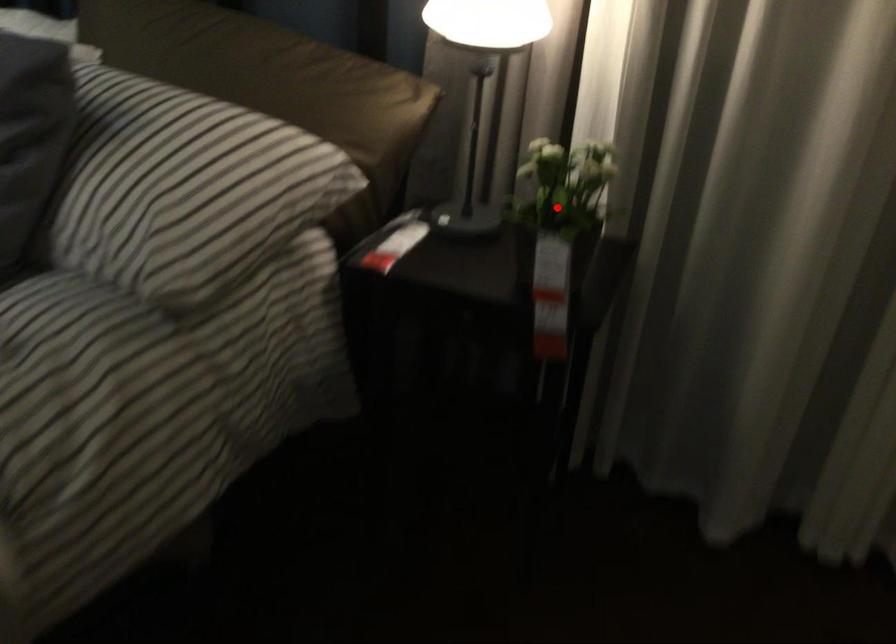
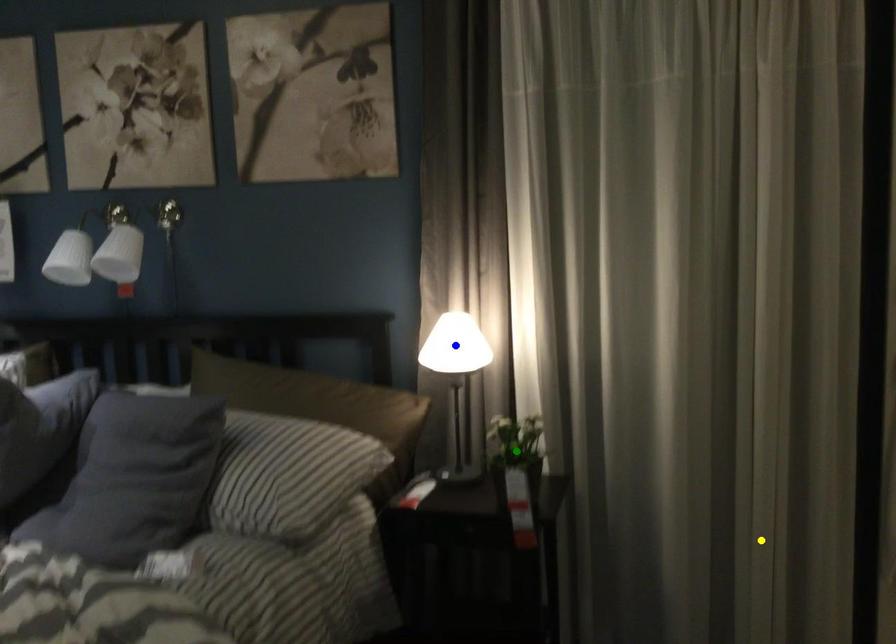
Question: I am providing you with two images of the same scene from different viewpoints. A red point is marked on the first image. You are given multiple points on the second image. Which point in image 2 represents the same 3d spot as the red point in image 1?

Choices:
 (A) yellow point
 (B) green point
 (C) blue point

Answer: (B)